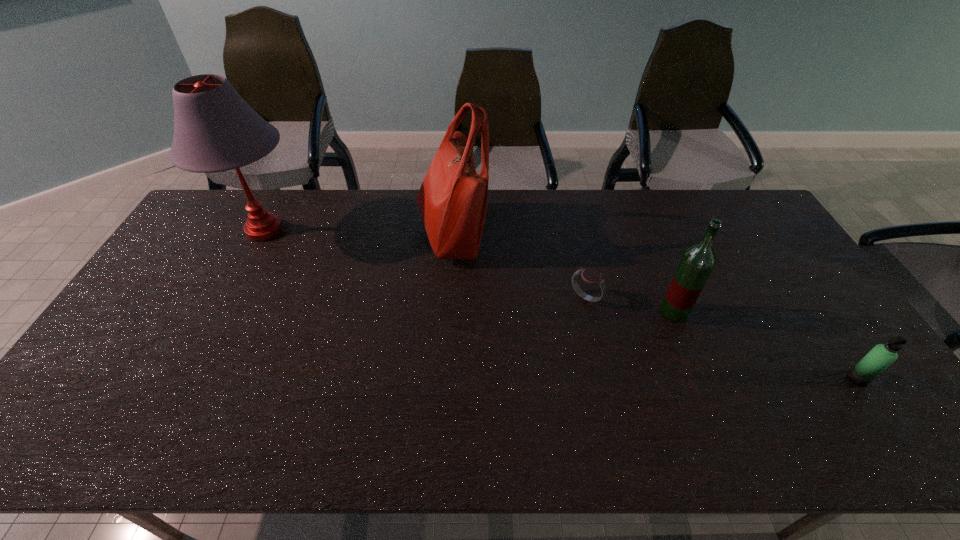
Where is `vacant area between the rightmost object and the second object from left to right`? vacant area between the rightmost object and the second object from left to right is located at coordinates (655, 306).

Locate an element on the screen. The image size is (960, 540). empty space between the fourth object from left to right and the third object from right to left is located at coordinates (630, 305).

Point out which object is positioned as the fourth nearest to the watch. Please provide its 2D coordinates. Your answer should be formatted as a tuple, i.e. [(x, y)], where the tuple contains the x and y coordinates of a point satisfying the conditions above.

[(215, 129)]

The width and height of the screenshot is (960, 540). What are the coordinates of `object that is the closest one to the leftmost object` in the screenshot? It's located at (452, 200).

This screenshot has width=960, height=540. Identify the location of blank space that satisfies the following two spatial constraints: 1. on the front-facing side of the second object from right to left; 2. on the right side of the fourth object from right to left. (446, 312).

Where is `free space that satisfies the following two spatial constraints: 1. on the front-facing side of the leftmost object; 2. on the back side of the third tallest object`? Image resolution: width=960 pixels, height=540 pixels. free space that satisfies the following two spatial constraints: 1. on the front-facing side of the leftmost object; 2. on the back side of the third tallest object is located at coordinates (222, 312).

Identify the location of free location that satisfies the following two spatial constraints: 1. on the front side of the second shortest object; 2. on the left side of the liquor. (700, 379).

Identify the location of free region that satisfies the following two spatial constraints: 1. on the back side of the liquor; 2. on the front-facing side of the handbag. This screenshot has height=540, width=960. (643, 234).

At what (x,y) coordinates should I click in order to perform the action: click on free spot that satisfies the following two spatial constraints: 1. on the back side of the watch; 2. on the front-facing side of the table lamp. Please return your answer as a coordinate pair (x, y). Looking at the image, I should click on (571, 231).

At what (x,y) coordinates should I click in order to perform the action: click on free location that satisfies the following two spatial constraints: 1. on the front-facing side of the handbag; 2. on the right side of the liquor. Please return your answer as a coordinate pair (x, y). This screenshot has height=540, width=960. Looking at the image, I should click on (446, 312).